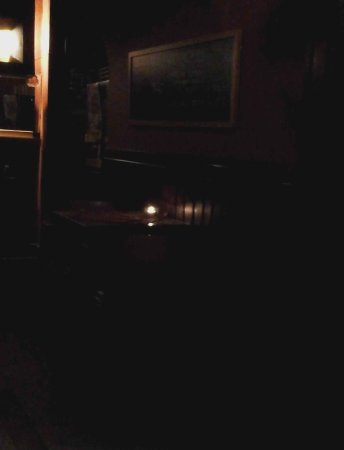
Where is `window`? The image size is (344, 450). window is located at coordinates (15, 48).